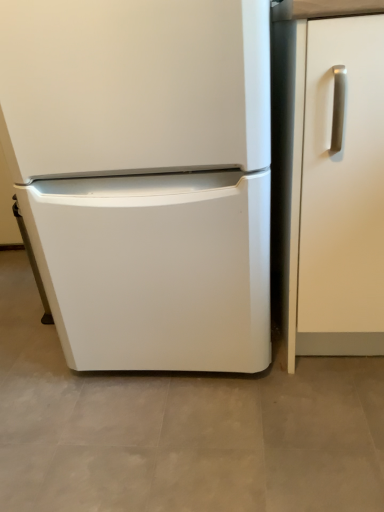
The image size is (384, 512). What do you see at coordinates (342, 193) in the screenshot? I see `white matte cabinet handle at right` at bounding box center [342, 193].

In order to face white matte cabinet handle at right, should I rotate leftwards or rightwards?

You should look right and rotate roughly 20.776 degrees.

Image resolution: width=384 pixels, height=512 pixels. I want to click on white matte cabinet handle at right, so [x=342, y=193].

Locate an element on the screen. This screenshot has width=384, height=512. white matte refrigerator at center is located at coordinates (145, 176).

Image resolution: width=384 pixels, height=512 pixels. Describe the element at coordinates (145, 176) in the screenshot. I see `white matte refrigerator at center` at that location.

Locate an element on the screen. white matte cabinet handle at right is located at coordinates (342, 193).

Is white matte refrigerator at center at the right side of white matte cabinet handle at right?

Incorrect, white matte refrigerator at center is not on the right side of white matte cabinet handle at right.

Considering the relative positions of white matte refrigerator at center and white matte cabinet handle at right in the image provided, is white matte refrigerator at center behind white matte cabinet handle at right?

No.

Considering the positions of point (28, 221) and point (334, 322), is point (28, 221) closer or farther from the camera than point (334, 322)?

Point (28, 221).

Based on the photo, from the image's perspective, which object appears higher, white matte refrigerator at center or white matte cabinet handle at right?

white matte refrigerator at center.

From a real-world perspective, is white matte refrigerator at center positioned under white matte cabinet handle at right based on gravity?

No, from a real-world perspective, white matte refrigerator at center is not under white matte cabinet handle at right.

Which of these two, white matte refrigerator at center or white matte cabinet handle at right, is wider?

Wider between the two is white matte refrigerator at center.

From their relative heights in the image, would you say white matte refrigerator at center is taller or shorter than white matte cabinet handle at right?

Considering their sizes, white matte refrigerator at center has more height than white matte cabinet handle at right.

Considering the sizes of objects white matte refrigerator at center and white matte cabinet handle at right in the image provided, who is bigger, white matte refrigerator at center or white matte cabinet handle at right?

white matte refrigerator at center is bigger.

Is white matte refrigerator at center positioned beyond the bounds of white matte cabinet handle at right?

Indeed, white matte refrigerator at center is completely outside white matte cabinet handle at right.

Are white matte refrigerator at center and white matte cabinet handle at right located far from each other?

No, white matte refrigerator at center is in close proximity to white matte cabinet handle at right.

Is white matte refrigerator at center facing away from white matte cabinet handle at right?

That's not correct — white matte refrigerator at center is not looking away from white matte cabinet handle at right.

Based on the photo, how many degrees apart are the facing directions of white matte refrigerator at center and white matte cabinet handle at right?

0.444 degrees separate the facing orientations of white matte refrigerator at center and white matte cabinet handle at right.

Where is `door located underneath the white matte refrigerator at center (from a real-world perspective)`? door located underneath the white matte refrigerator at center (from a real-world perspective) is located at coordinates [342, 193].

Considering the positions of objects white matte cabinet handle at right and white matte refrigerator at center in the image provided, who is more to the left, white matte cabinet handle at right or white matte refrigerator at center?

Positioned to the left is white matte refrigerator at center.

Relative to white matte refrigerator at center, is white matte cabinet handle at right in front or behind?

Visually, white matte cabinet handle at right is located behind white matte refrigerator at center.

Which point is more distant from viewer, (346, 313) or (237, 227)?

The point (346, 313) is farther from the camera.

From the image's perspective, is white matte cabinet handle at right positioned above or below white matte refrigerator at center?

white matte cabinet handle at right is situated lower than white matte refrigerator at center in the image.

Consider the image. From a real-world perspective, is white matte cabinet handle at right physically located above or below white matte refrigerator at center?

From a real-world perspective, white matte cabinet handle at right is physically below white matte refrigerator at center.

Can you confirm if white matte cabinet handle at right is thinner than white matte refrigerator at center?

Yes.

Is white matte cabinet handle at right shorter than white matte refrigerator at center?

Yes, white matte cabinet handle at right is shorter than white matte refrigerator at center.

Is white matte cabinet handle at right bigger or smaller than white matte refrigerator at center?

Clearly, white matte cabinet handle at right is smaller in size than white matte refrigerator at center.

Is white matte cabinet handle at right not inside white matte refrigerator at center?

white matte cabinet handle at right is positioned outside white matte refrigerator at center.

Can you see white matte cabinet handle at right touching white matte refrigerator at center?

No, white matte cabinet handle at right is not in contact with white matte refrigerator at center.

Is white matte cabinet handle at right looking in the opposite direction of white matte refrigerator at center?

No.

Can you tell me how much white matte cabinet handle at right and white matte refrigerator at center differ in facing direction?

The angular difference between white matte cabinet handle at right and white matte refrigerator at center is 0.444 degrees.

Measure the distance between white matte cabinet handle at right and white matte refrigerator at center.

The distance of white matte cabinet handle at right from white matte refrigerator at center is 11.71 inches.

Where is `door located on the right of white matte refrigerator at center`? door located on the right of white matte refrigerator at center is located at coordinates (342, 193).

Where is `door below the white matte refrigerator at center (from a real-world perspective)`? This screenshot has width=384, height=512. door below the white matte refrigerator at center (from a real-world perspective) is located at coordinates (342, 193).

Find the location of a particular element. The image size is (384, 512). refrigerator that is in front of the white matte cabinet handle at right is located at coordinates (145, 176).